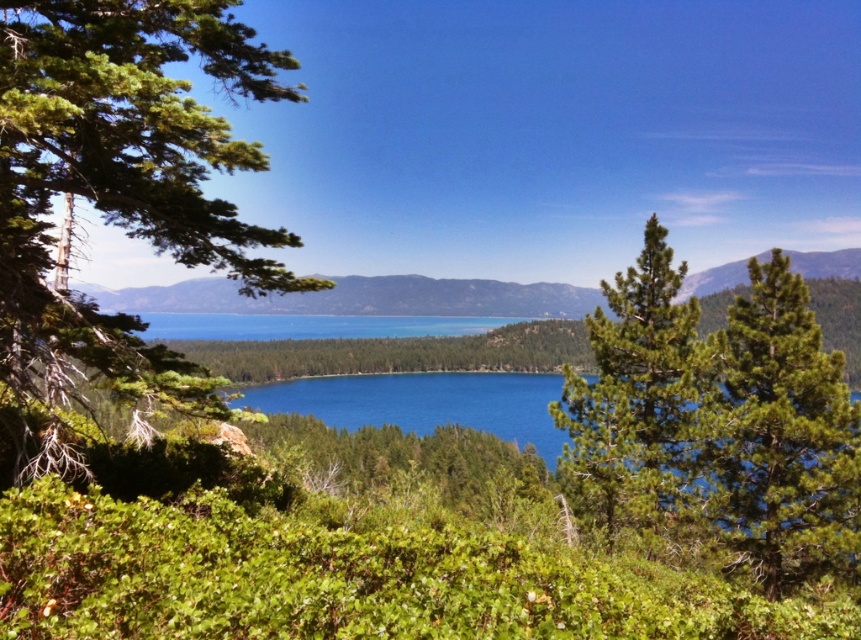
Question: Does green leafy tree at left come in front of green needle-like at right?

Choices:
 (A) yes
 (B) no

Answer: (A)

Question: Which object is closer to the camera taking this photo?

Choices:
 (A) green needle-like at right
 (B) green leafy tree at left
 (C) green needle-like at center

Answer: (B)

Question: Which point is farther from the camera taking this photo?

Choices:
 (A) (150, 28)
 (B) (629, 516)
 (C) (853, 557)

Answer: (B)

Question: Which of the following is the closest to the observer?

Choices:
 (A) (822, 428)
 (B) (189, 26)

Answer: (B)

Question: Can you confirm if green leafy tree at left is positioned to the left of green needle-like at center?

Choices:
 (A) yes
 (B) no

Answer: (A)

Question: Is green needle-like at right positioned behind green needle-like at center?

Choices:
 (A) yes
 (B) no

Answer: (A)